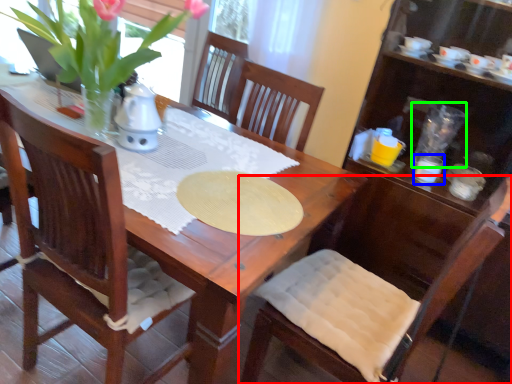
Question: Based on their relative distances, which object is farther from chair (highlighted by a red box)? Choose from tableware (highlighted by a blue box) and tableware (highlighted by a green box).

Choices:
 (A) tableware
 (B) tableware

Answer: (B)